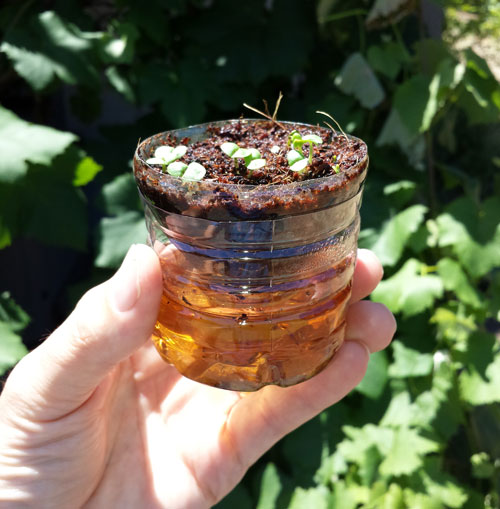
This screenshot has width=500, height=509. In order to click on plastic container in this screenshot , I will do pos(305,330).